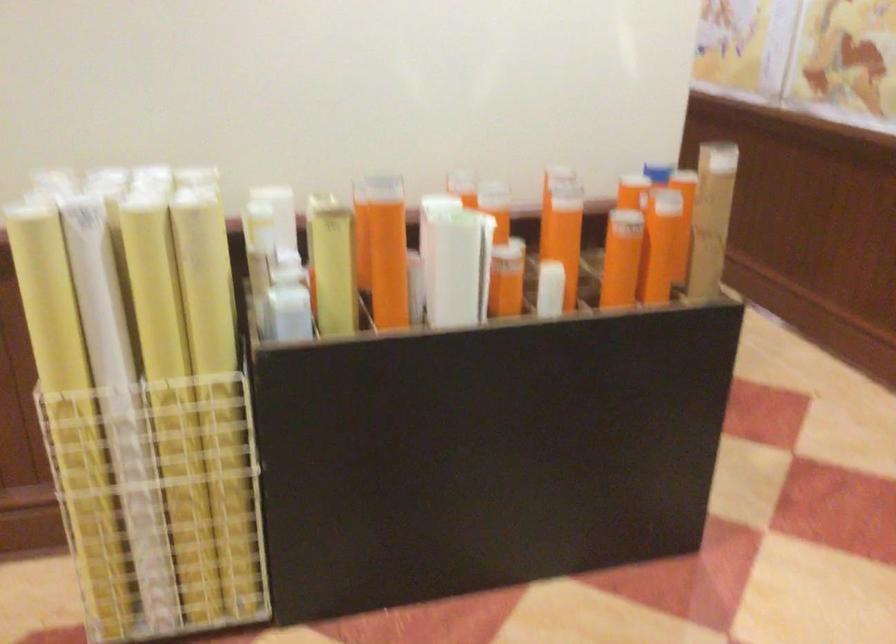
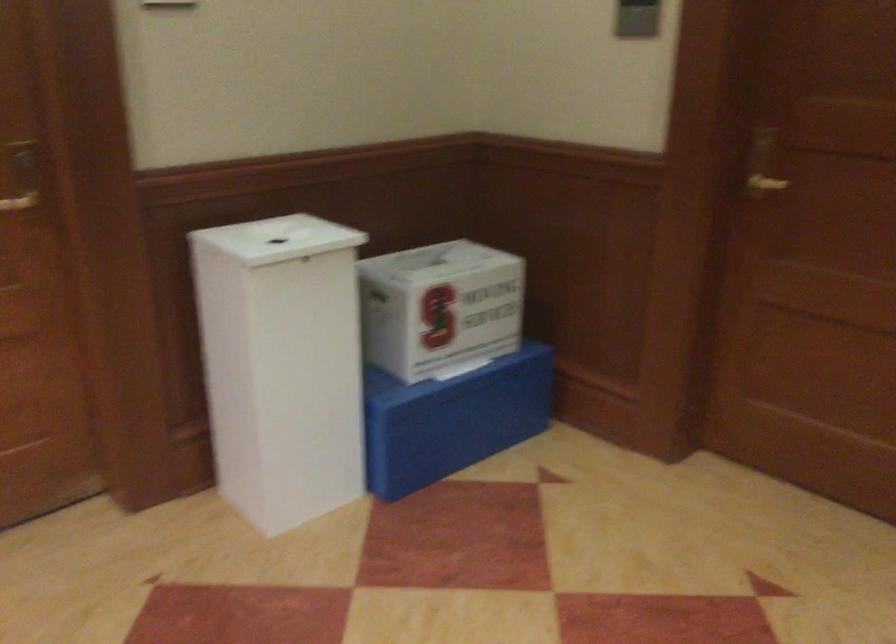
The first image is from the beginning of the video and the second image is from the end. How did the camera likely rotate when shooting the video?

The camera's rotation is toward right-down.